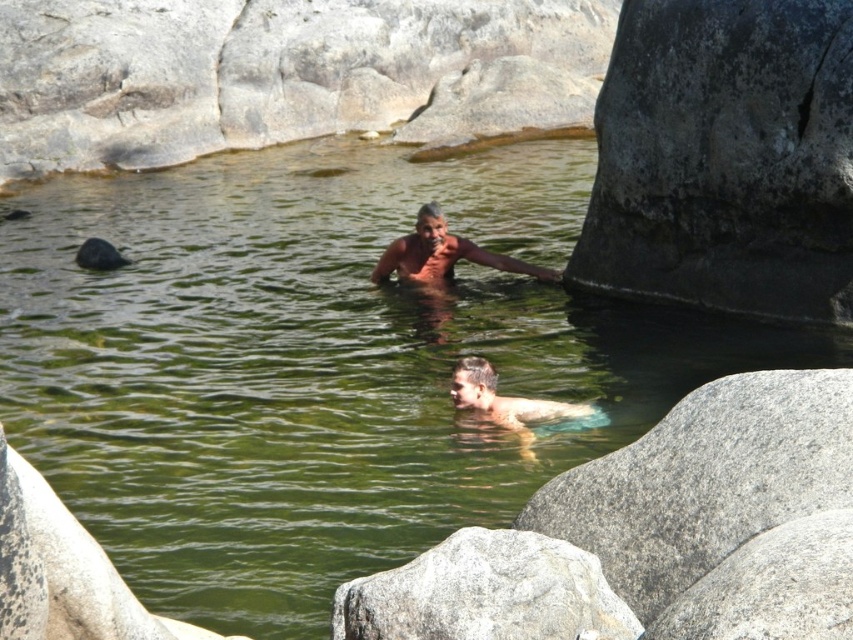
At what (x,y) coordinates should I click in order to perform the action: click on gray rough rock at lower center. Please return your answer as a coordinate pair (x, y). The image size is (853, 640). Looking at the image, I should click on (486, 593).

Between point (593, 557) and point (456, 381), which one is positioned in front?

Point (593, 557) is in front.

Which is in front, point (502, 632) or point (523, 452)?

Point (502, 632)

Identify the location of gray rough rock at lower center. The image size is (853, 640). (486, 593).

Does gray rough rock at lower center lie in front of brown skin at center?

Yes, it is in front of brown skin at center.

Between point (438, 548) and point (456, 241), which one is positioned behind?

The point (456, 241) is behind.

Where is `gray rough rock at lower center`? The image size is (853, 640). gray rough rock at lower center is located at coordinates (486, 593).

I want to click on gray rough rock at right, so click(x=724, y=157).

Which is more to the right, gray rough rock at right or smooth skin man at center?

gray rough rock at right

Which is behind, point (701, 221) or point (466, 378)?

Positioned behind is point (701, 221).

You are a GUI agent. You are given a task and a screenshot of the screen. Output one action in this format:
    pyautogui.click(x=<x>, y=<y>)
    Task: Click on the gray rough rock at right
    This screenshot has height=640, width=853.
    Given the screenshot: What is the action you would take?
    pyautogui.click(x=724, y=157)